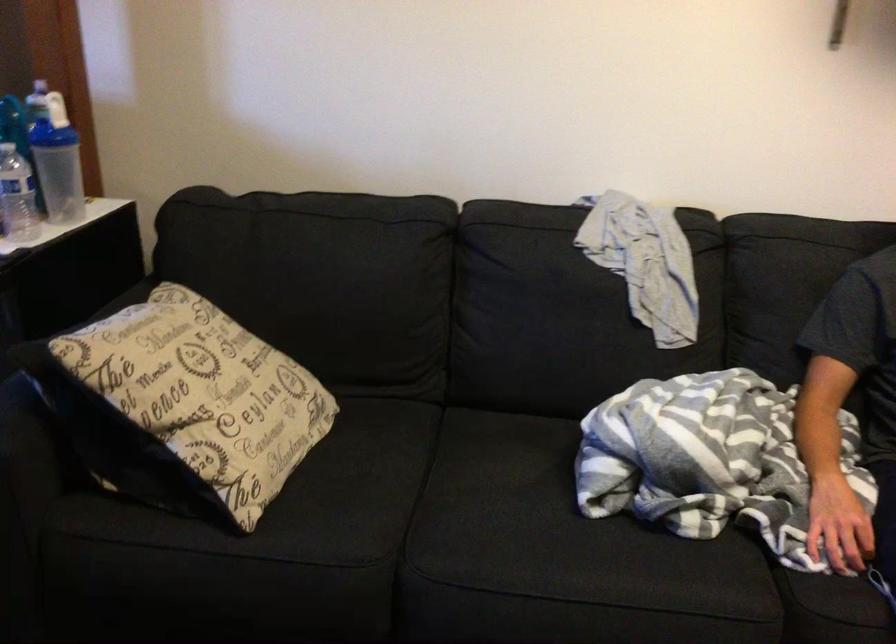
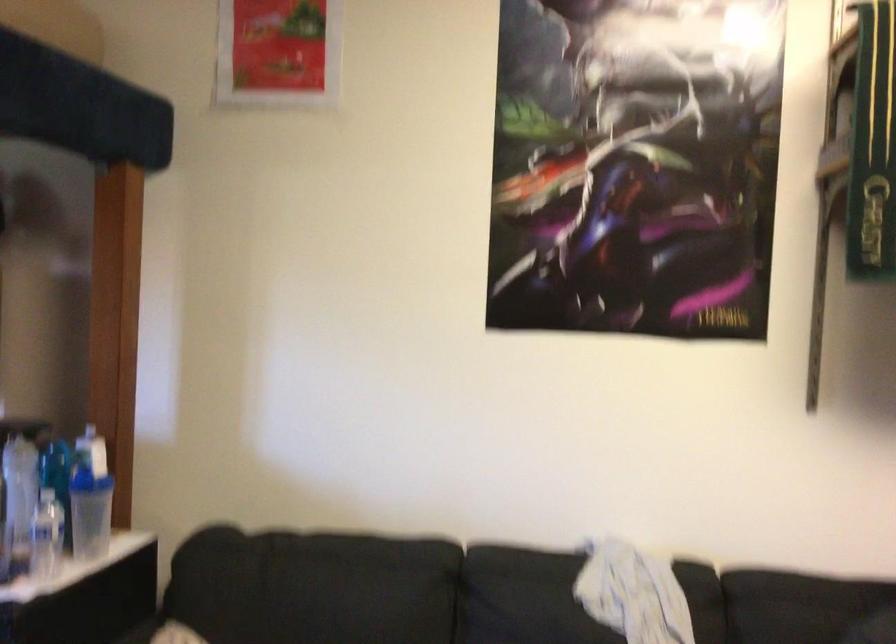
The images are taken continuously from a first-person perspective. In which direction are you moving?

The movement direction of the cameraman is right, backward.